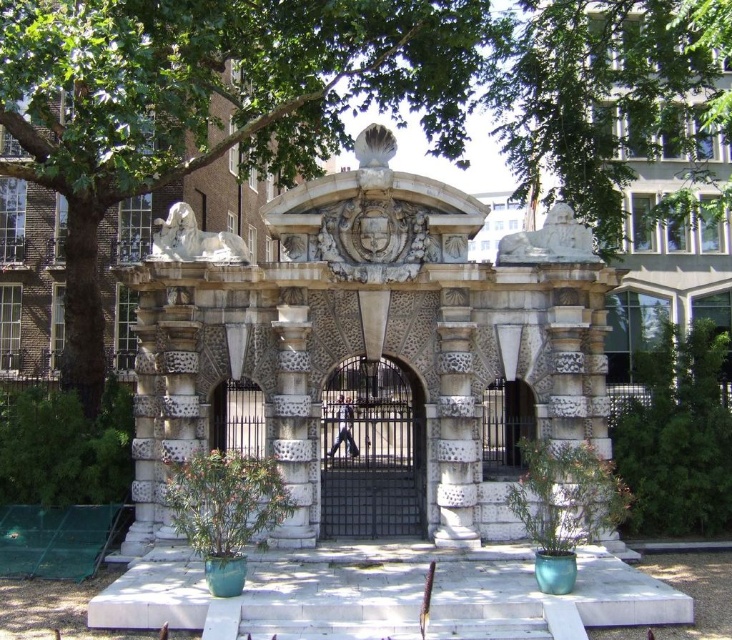
Is green leafy tree at center bigger than polished metal gate at center?

Yes.

Can you confirm if green leafy tree at center is positioned to the left of polished metal gate at center?

Correct, you'll find green leafy tree at center to the left of polished metal gate at center.

Where is `green leafy tree at center`? This screenshot has height=640, width=732. green leafy tree at center is located at coordinates (212, 100).

Who is higher up, white stone gate at center or green leafy tree at center?

green leafy tree at center is higher up.

Between point (408, 328) and point (171, 148), which one is positioned behind?

Positioned behind is point (171, 148).

Where is `white stone gate at center`? The image size is (732, 640). white stone gate at center is located at coordinates (366, 336).

Which is more to the left, black metal gate at center or polished metal gate at center?

From the viewer's perspective, black metal gate at center appears more on the left side.

Between black metal gate at center and polished metal gate at center, which one has more height?

Standing taller between the two is polished metal gate at center.

The width and height of the screenshot is (732, 640). What do you see at coordinates (370, 452) in the screenshot? I see `black metal gate at center` at bounding box center [370, 452].

Where is `black metal gate at center`? black metal gate at center is located at coordinates (370, 452).